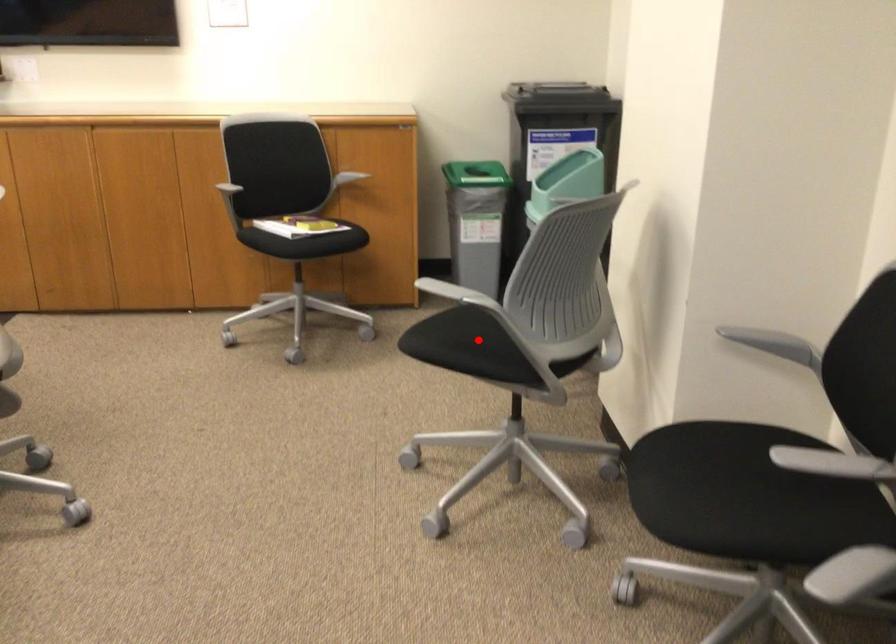
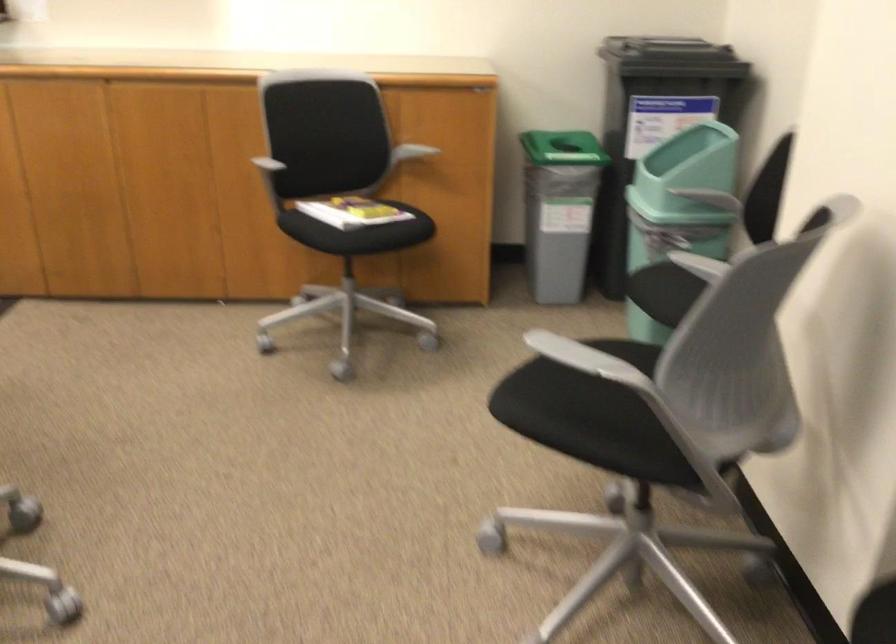
Question: I am providing you with two images of the same scene from different viewpoints. Image1 has a red point marked. In image2, the corresponding 3D location appears at what relative position? Reply with the corresponding letter.

Choices:
 (A) Closer
 (B) Farther

Answer: (A)